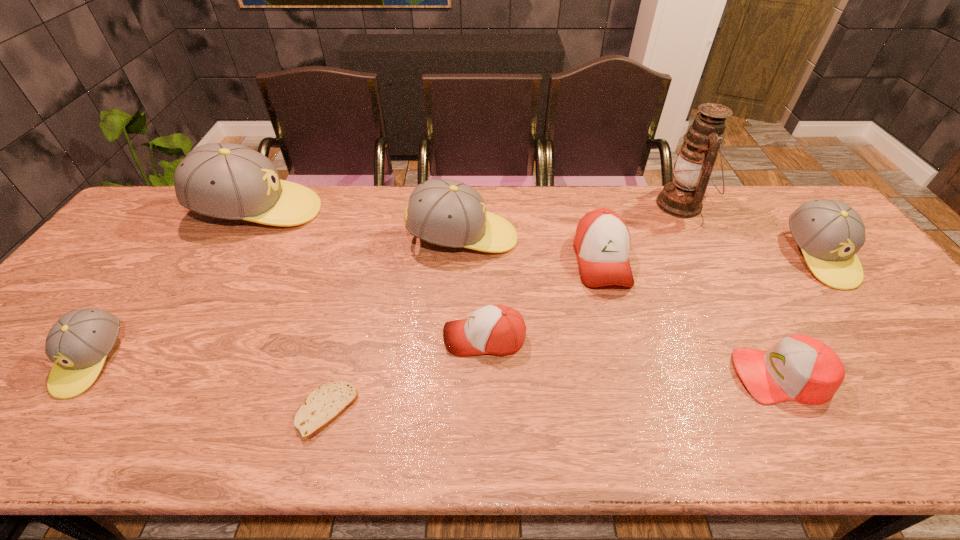
Identify the location of the closest yellow baseball cap relative to the red baseball cap. (829, 232).

Identify the location of vacant space that satisfies the following two spatial constraints: 1. on the front-facing side of the smaller orange baseball cap; 2. on the front-facing side of the nearest yellow baseball cap. The image size is (960, 540). (485, 361).

This screenshot has width=960, height=540. In order to click on free space that satisfies the following two spatial constraints: 1. on the front-facing side of the third object from left to right; 2. on the right side of the eighth shortest object in this screenshot , I will do `click(146, 411)`.

Locate an element on the screen. free space that satisfies the following two spatial constraints: 1. on the front-facing side of the rightmost yellow baseball cap; 2. on the front-facing side of the red baseball cap is located at coordinates (911, 375).

Find the location of a particular element. The image size is (960, 540). blank space that satisfies the following two spatial constraints: 1. on the front-facing side of the rightmost baseball cap; 2. on the front-facing side of the second baseball cap from right to left is located at coordinates (911, 375).